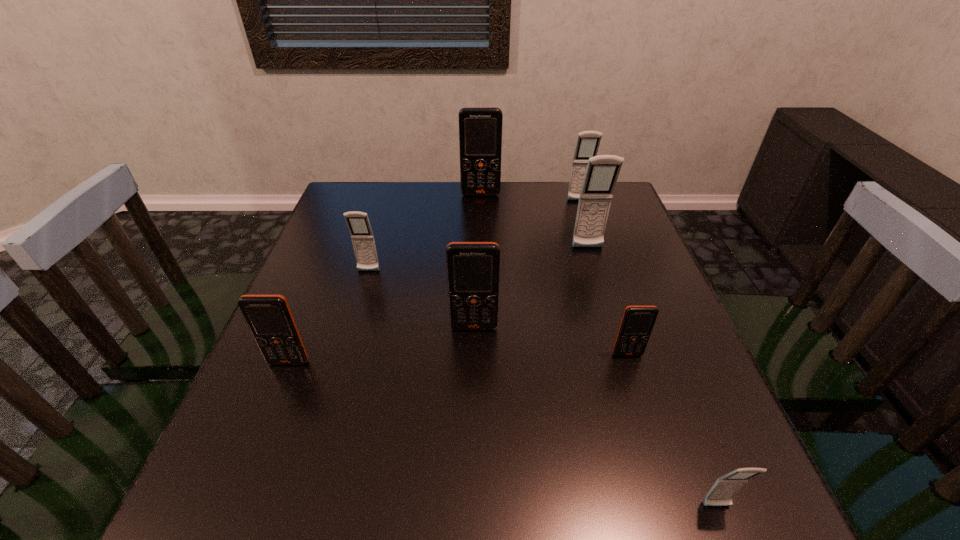
In the image, there is a desktop. Identify the location of vacant space at the far left corner. The height and width of the screenshot is (540, 960). (341, 199).

This screenshot has height=540, width=960. What are the coordinates of `free point between the rightmost cellular telephone and the third biggest orange cellular telephone` in the screenshot? It's located at (503, 434).

The width and height of the screenshot is (960, 540). I want to click on free space between the nearest object and the nearest orange cellular telephone, so click(503, 434).

You are a GUI agent. You are given a task and a screenshot of the screen. Output one action in this format:
    pyautogui.click(x=<x>, y=<y>)
    Task: Click on the free space between the second biggest orange cellular telephone and the fourth farthest cellular telephone
    
    Given the screenshot: What is the action you would take?
    pyautogui.click(x=421, y=299)

Locate an element on the screen. Image resolution: width=960 pixels, height=540 pixels. free area in between the second nearest object and the third nearest object is located at coordinates (458, 358).

Locate an element on the screen. The height and width of the screenshot is (540, 960). free space that is in between the fourth nearest object and the third nearest gray cellular telephone is located at coordinates (531, 288).

Locate an element on the screen. This screenshot has height=540, width=960. empty space that is in between the seventh nearest cellular telephone and the leftmost cellular telephone is located at coordinates (434, 281).

The width and height of the screenshot is (960, 540). In order to click on vacant area that lies between the sixth nearest object and the fifth farthest cellular telephone in this screenshot , I will do `click(531, 288)`.

Find the location of a particular element. vacant area that lies between the rightmost orange cellular telephone and the nearest gray cellular telephone is located at coordinates (672, 430).

The height and width of the screenshot is (540, 960). What are the coordinates of `object that stands as the seventh closest to the fourth nearest object` in the screenshot? It's located at (588, 142).